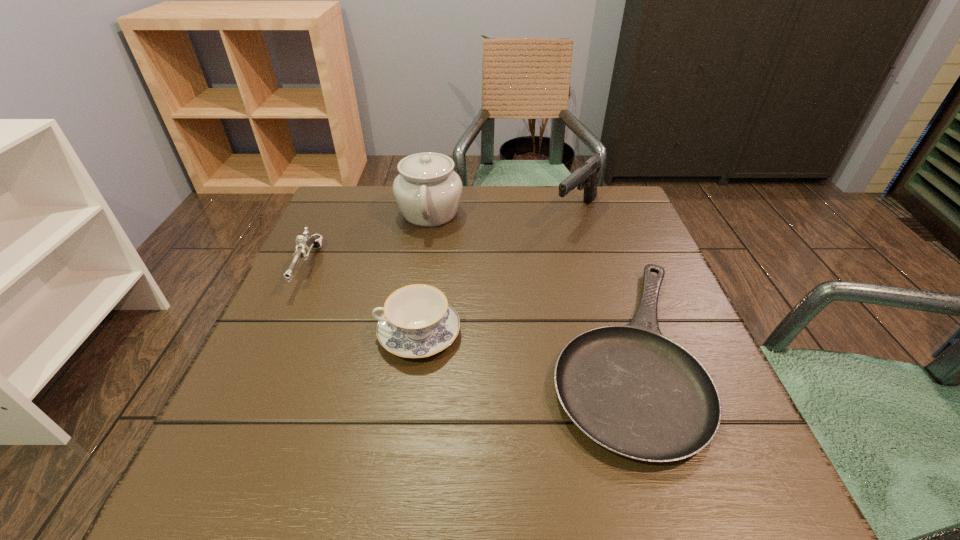
Find the location of a particular element. This screenshot has height=540, width=960. object that is positioned at the far right corner is located at coordinates pyautogui.click(x=586, y=175).

The image size is (960, 540). I want to click on object at the near right corner, so click(x=630, y=389).

Locate an element on the screen. free space at the far edge is located at coordinates (563, 206).

Image resolution: width=960 pixels, height=540 pixels. I want to click on free space at the near edge of the desktop, so click(x=491, y=491).

Find the location of a particular element. vacant space at the left edge of the desktop is located at coordinates (273, 420).

Image resolution: width=960 pixels, height=540 pixels. In order to click on vacant space at the far left corner in this screenshot , I will do point(333,202).

The width and height of the screenshot is (960, 540). I want to click on free space at the far right corner, so click(x=590, y=211).

This screenshot has width=960, height=540. I want to click on vacant space at the near right corner of the desktop, so click(x=660, y=470).

Locate an element on the screen. This screenshot has width=960, height=540. free space that is in between the frying pan and the nearer chinaware is located at coordinates (520, 342).

At what (x,y) coordinates should I click in order to perform the action: click on vacant point located between the leftmost object and the shortest object. Please return your answer as a coordinate pair (x, y). The height and width of the screenshot is (540, 960). Looking at the image, I should click on (465, 309).